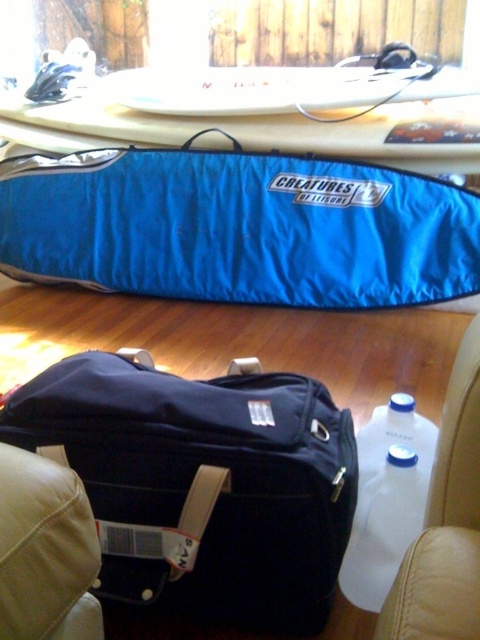
You are moving into a new apartment and need to determine which item is taller between the blue fabric surfboard at upper center and the leather at lower right. Based on the scene, which one is taller?

The blue fabric surfboard at upper center is taller than the leather at lower right.

You are standing in the room and want to pick up the leather at lower right and the white glossy surfboard at upper center. Which object is closer to you?

The leather at lower right is closer to you than the white glossy surfboard at upper center since it is only 5.47 feet away.